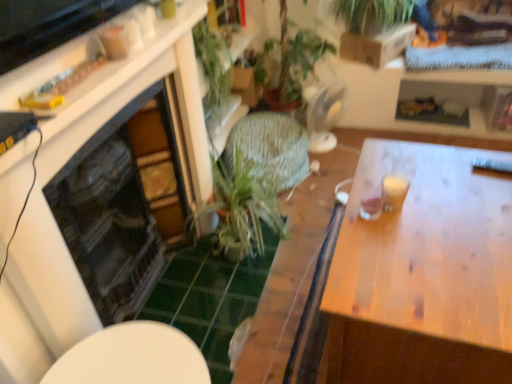
Question: Is green leafy plant at upper center to the right of white glossy table at lower center from the viewer's perspective?

Choices:
 (A) no
 (B) yes

Answer: (B)

Question: Is green leafy plant at upper center oriented away from white glossy table at lower center?

Choices:
 (A) no
 (B) yes

Answer: (A)

Question: Is white glossy table at lower center inside green leafy plant at upper center?

Choices:
 (A) no
 (B) yes

Answer: (A)

Question: From a real-world perspective, is green leafy plant at upper center located beneath white glossy table at lower center?

Choices:
 (A) no
 (B) yes

Answer: (A)

Question: From the image's perspective, is green leafy plant at upper center under white glossy table at lower center?

Choices:
 (A) yes
 (B) no

Answer: (B)

Question: Is white glossy table at lower center taller or shorter than green leafy plant at upper center?

Choices:
 (A) short
 (B) tall

Answer: (B)

Question: From the image's perspective, relative to green leafy plant at upper center, is white glossy table at lower center above or below?

Choices:
 (A) above
 (B) below

Answer: (B)

Question: In the image, is white glossy table at lower center on the left side or the right side of green leafy plant at upper center?

Choices:
 (A) left
 (B) right

Answer: (A)

Question: In terms of size, does white glossy table at lower center appear bigger or smaller than green leafy plant at upper center?

Choices:
 (A) small
 (B) big

Answer: (A)

Question: Is green leafy plant at upper center in front of or behind wooden table at right in the image?

Choices:
 (A) behind
 (B) front

Answer: (A)

Question: Is green leafy plant at upper center taller or shorter than wooden table at right?

Choices:
 (A) short
 (B) tall

Answer: (A)

Question: Considering the positions of point (354, 8) and point (365, 274), is point (354, 8) closer or farther from the camera than point (365, 274)?

Choices:
 (A) farther
 (B) closer

Answer: (A)

Question: In the image, is green leafy plant at upper center on the left side or the right side of wooden table at right?

Choices:
 (A) left
 (B) right

Answer: (B)

Question: Is wooden table at right bigger or smaller than green leafy plant at center?

Choices:
 (A) big
 (B) small

Answer: (A)

Question: From their relative heights in the image, would you say wooden table at right is taller or shorter than green leafy plant at center?

Choices:
 (A) short
 (B) tall

Answer: (B)